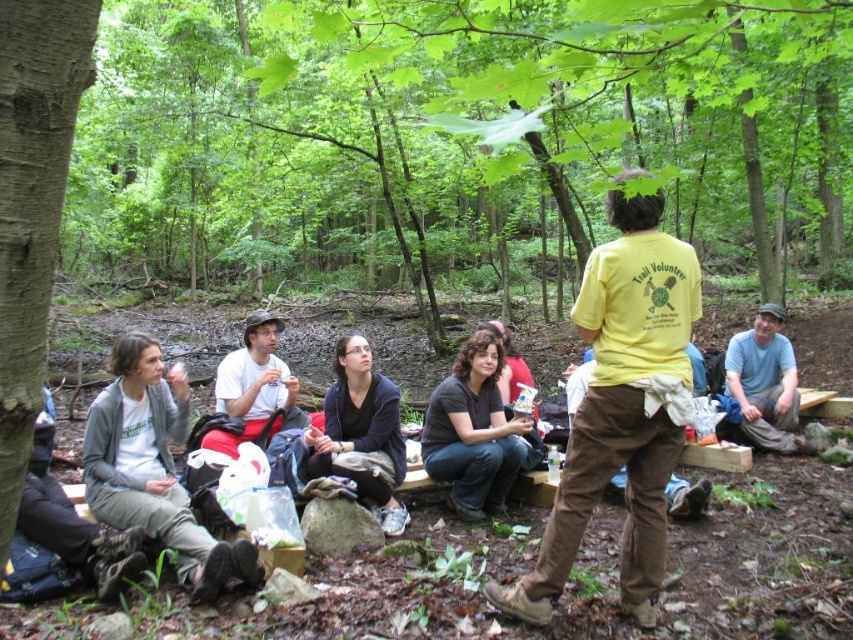
Question: Estimate the real-world distances between objects in this image. Which object is closer to the yellow cotton shirt at center?

Choices:
 (A) smooth brown bark at left
 (B) black cotton shirt at center
 (C) gray fleece jacket at lower left

Answer: (B)

Question: Is yellow cotton shirt at center wider than smooth brown bark at left?

Choices:
 (A) no
 (B) yes

Answer: (B)

Question: Is gray fleece jacket at lower left positioned at the back of blue cotton shirt at lower right?

Choices:
 (A) no
 (B) yes

Answer: (A)

Question: Which point is farther to the camera?

Choices:
 (A) (393, 531)
 (B) (465, 468)

Answer: (B)

Question: Estimate the real-world distances between objects in this image. Which object is farther from the blue cotton shirt at lower right?

Choices:
 (A) yellow cotton shirt at center
 (B) black matte jacket at center

Answer: (A)

Question: Does smooth brown bark at left have a smaller size compared to blue cotton shirt at lower right?

Choices:
 (A) no
 (B) yes

Answer: (B)